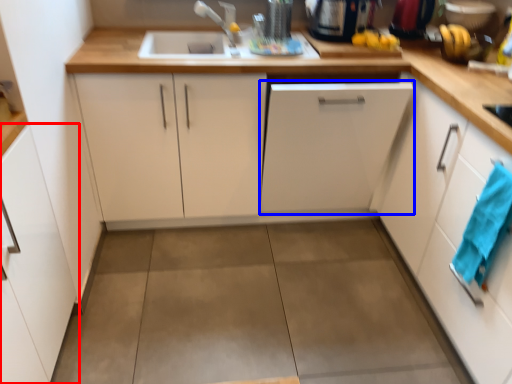
Question: Which of the following is the closest to the observer, cabinetry (highlighted by a red box) or cabinetry (highlighted by a blue box)?

Choices:
 (A) cabinetry
 (B) cabinetry

Answer: (A)